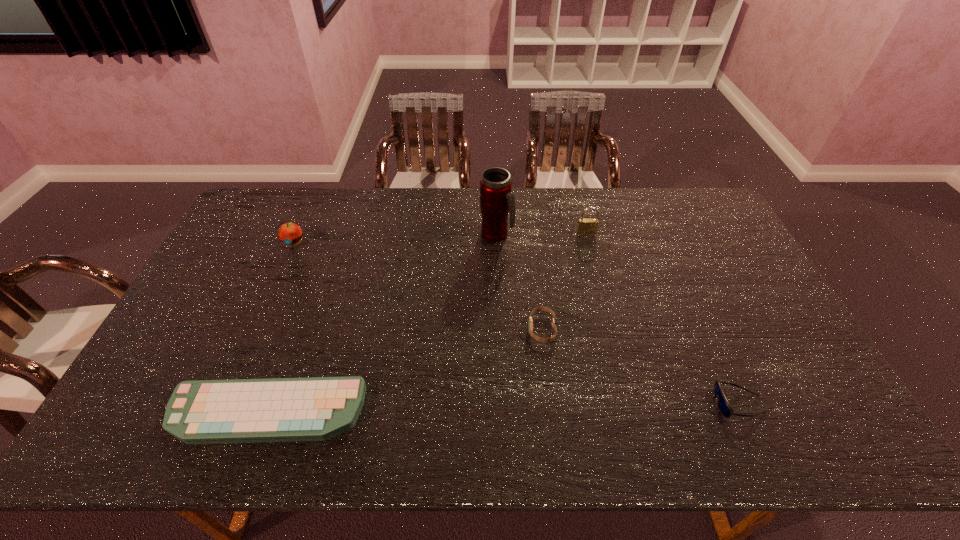
I want to click on object that can be found as the fifth closest to the apple, so click(x=724, y=406).

This screenshot has width=960, height=540. Identify the location of object that can be found as the closest to the apple. (318, 408).

The height and width of the screenshot is (540, 960). Find the location of `free location that satisfies the following two spatial constraints: 1. on the side with the handle of the third object from left to right; 2. on the front side of the fourth shortest object`. free location that satisfies the following two spatial constraints: 1. on the side with the handle of the third object from left to right; 2. on the front side of the fourth shortest object is located at coordinates (496, 242).